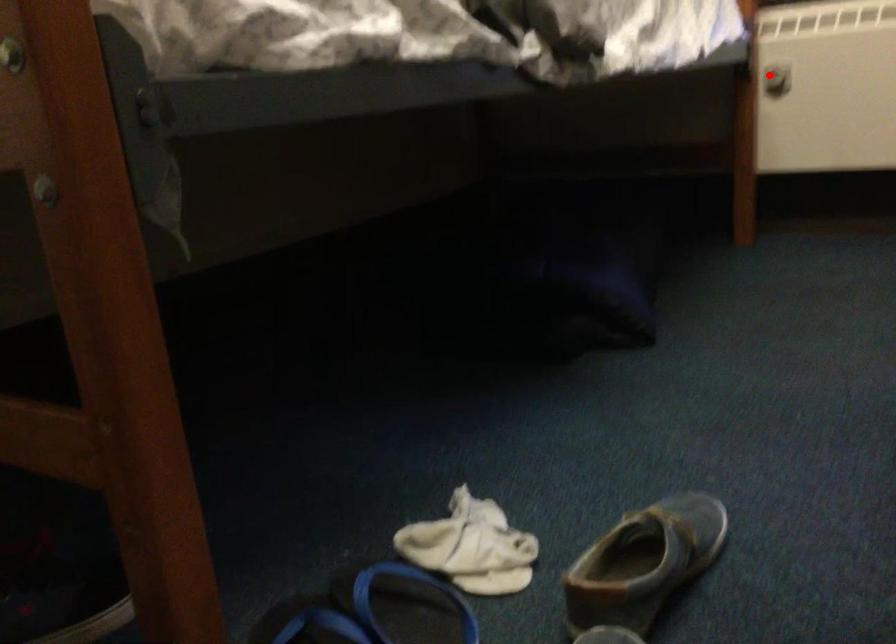
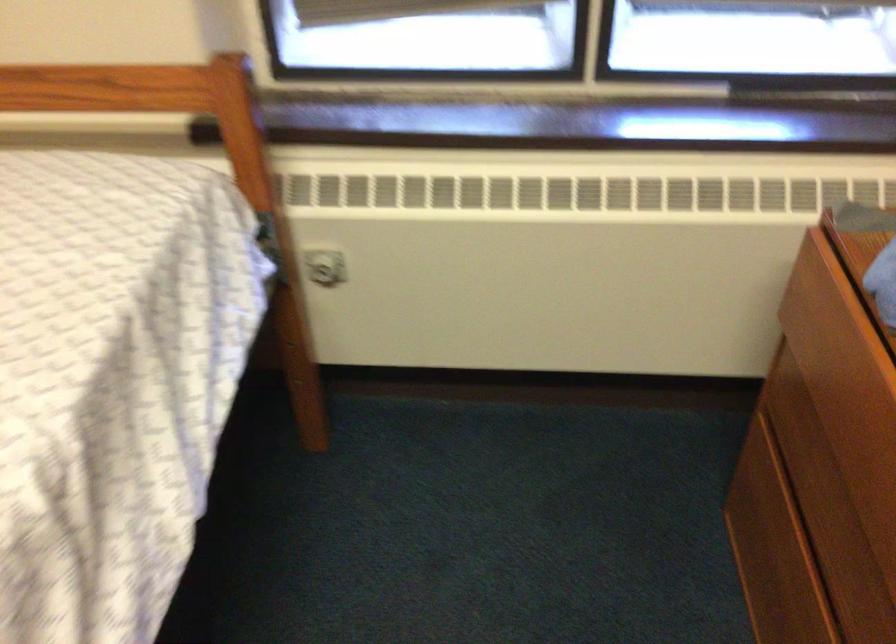
In the second image, find the point that corresponds to the highlighted location in the first image.

(323, 267)